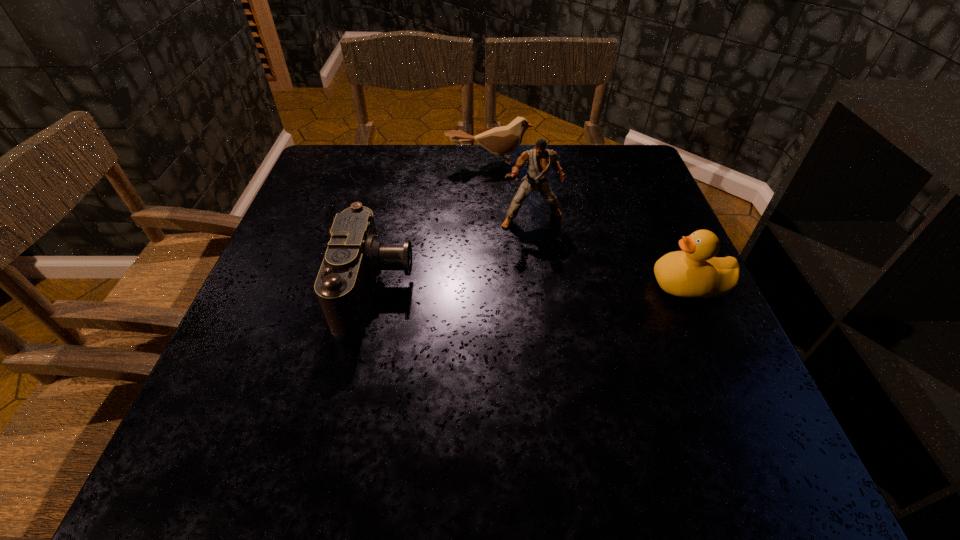
What are the coordinates of `the leftmost object` in the screenshot? It's located at [x=354, y=259].

Locate an element on the screen. The width and height of the screenshot is (960, 540). the rightmost object is located at coordinates (694, 272).

Where is `bird`? bird is located at coordinates (501, 140).

The image size is (960, 540). What are the coordinates of `puncher` in the screenshot? It's located at (539, 160).

Locate an element on the screen. This screenshot has height=540, width=960. the tallest object is located at coordinates (539, 160).

What are the coordinates of `vacant position located on the front-facing side of the leftmost object` in the screenshot? It's located at (560, 287).

Locate an element on the screen. vacant region located 0.300m on the face of the duck is located at coordinates (506, 285).

The image size is (960, 540). In order to click on vacant space located on the face of the duck in this screenshot , I will do `click(506, 285)`.

Find the location of a particular element. vacant region located on the face of the duck is located at coordinates (544, 285).

You are a GUI agent. You are given a task and a screenshot of the screen. Output one action in this format:
    pyautogui.click(x=<x>, y=<y>)
    Task: Click on the blank space located at the beak of the bird
    
    Given the screenshot: What is the action you would take?
    pyautogui.click(x=517, y=259)